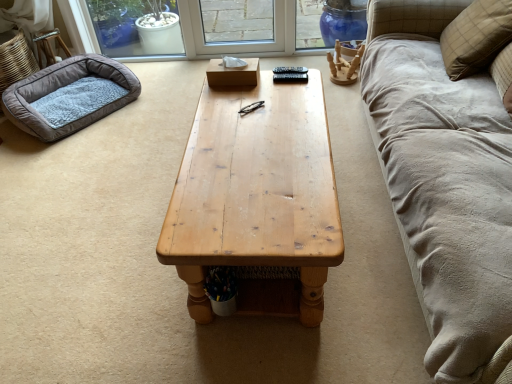
Question: Considering the relative positions of soft gray fleece dog bed at left and beige plaid pillow at upper right in the image provided, is soft gray fleece dog bed at left to the left or to the right of beige plaid pillow at upper right?

Choices:
 (A) right
 (B) left

Answer: (B)

Question: Is soft gray fleece dog bed at left taller or shorter than beige plaid pillow at upper right?

Choices:
 (A) tall
 (B) short

Answer: (B)

Question: Estimate the real-world distances between objects in this image. Which object is closer to the soft gray fleece dog bed at left?

Choices:
 (A) beige plaid pillow at upper right
 (B) wooden tissue box at center
 (C) natural wood coffee table at center

Answer: (B)

Question: Which object is positioned farthest from the wooden tissue box at center?

Choices:
 (A) natural wood coffee table at center
 (B) beige plaid pillow at upper right
 (C) soft gray fleece dog bed at left

Answer: (C)